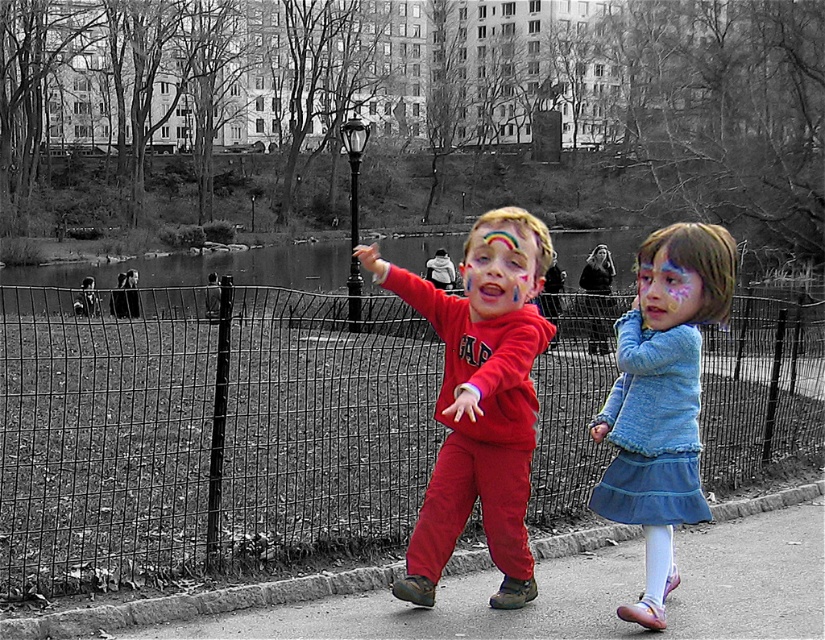
Question: Does blue knit sweater at center have a larger size compared to rainbow painted face at center?

Choices:
 (A) no
 (B) yes

Answer: (B)

Question: Which object is positioned closest to the velvet red hoodie at center?

Choices:
 (A) smooth asphalt road at center
 (B) rainbow painted face at center
 (C) pastel painted face at center

Answer: (B)

Question: Is black wire fence at center to the right of blue knit sweater at center from the viewer's perspective?

Choices:
 (A) yes
 (B) no

Answer: (B)

Question: Is smooth asphalt road at center to the left of rainbow painted face at center from the viewer's perspective?

Choices:
 (A) yes
 (B) no

Answer: (B)

Question: Which point appears closest to the camera in this image?

Choices:
 (A) (684, 616)
 (B) (670, 323)

Answer: (B)

Question: Which point appears closest to the camera in this image?

Choices:
 (A) (536, 288)
 (B) (269, 360)
 (C) (661, 298)
 (D) (521, 464)

Answer: (A)